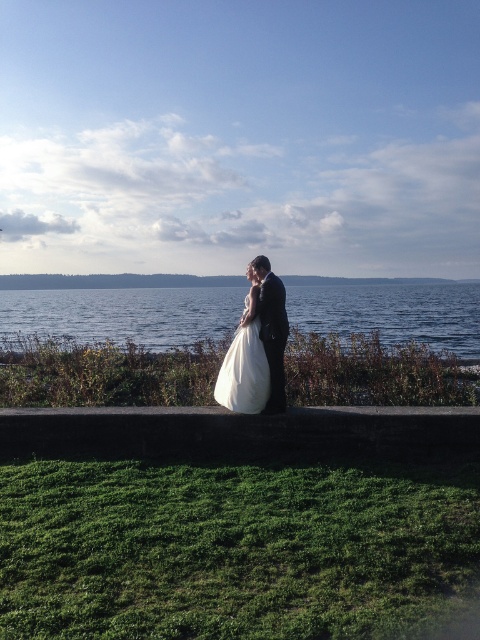
Is blue water at center behind satin black suit at center?

Yes, it is.

Is blue water at center taller than satin black suit at center?

Yes, blue water at center is taller than satin black suit at center.

Is point (38, 332) more distant than point (271, 346)?

Yes, it is.

The height and width of the screenshot is (640, 480). I want to click on blue water at center, so click(123, 314).

Between white satin dress at center and satin black suit at center, which one is positioned lower?

white satin dress at center

Can you confirm if white satin dress at center is positioned above satin black suit at center?

Actually, white satin dress at center is below satin black suit at center.

From the picture: Who is more forward, (247, 298) or (275, 360)?

Point (275, 360) is in front.

The height and width of the screenshot is (640, 480). Identify the location of white satin dress at center. (244, 360).

Who is taller, blue water at center or white satin dress at center?

blue water at center

Based on the photo, between blue water at center and white satin dress at center, which one appears on the left side from the viewer's perspective?

white satin dress at center is more to the left.

Locate an element on the screen. The height and width of the screenshot is (640, 480). blue water at center is located at coordinates (123, 314).

Locate an element on the screen. This screenshot has height=640, width=480. blue water at center is located at coordinates (123, 314).